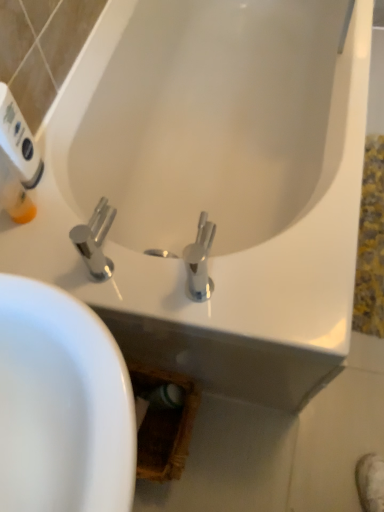
I want to click on vacant area located to the right-hand side of polished chrome faucet at center, so click(198, 282).